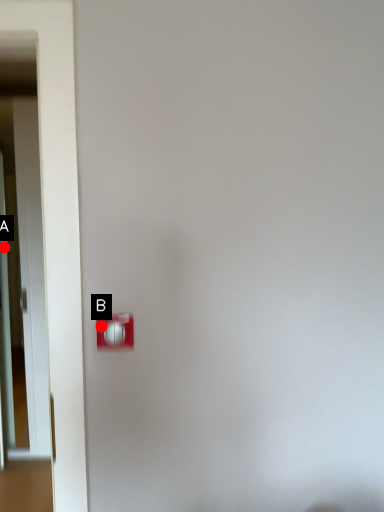
Question: Two points are circled on the image, labeled by A and B beside each circle. Which of the following is the farthest from the observer?

Choices:
 (A) A is further
 (B) B is further

Answer: (A)